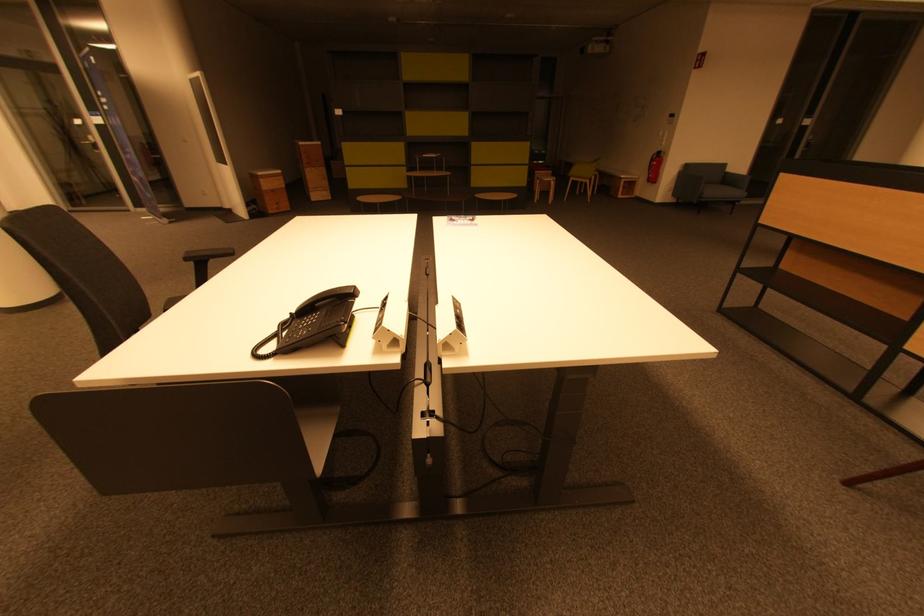
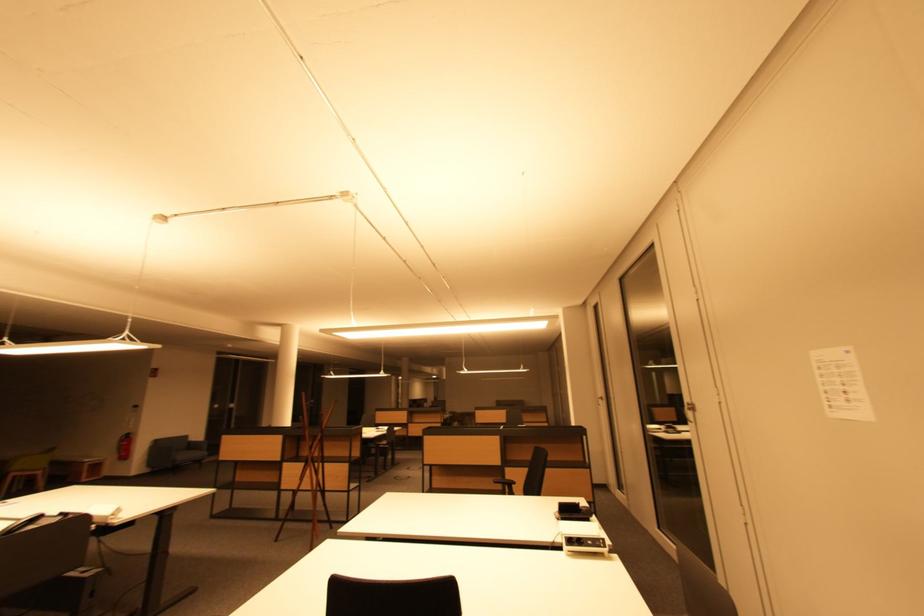
Where in the second image is the point corresponding to the point at 659,180 from the first image?

(128, 458)